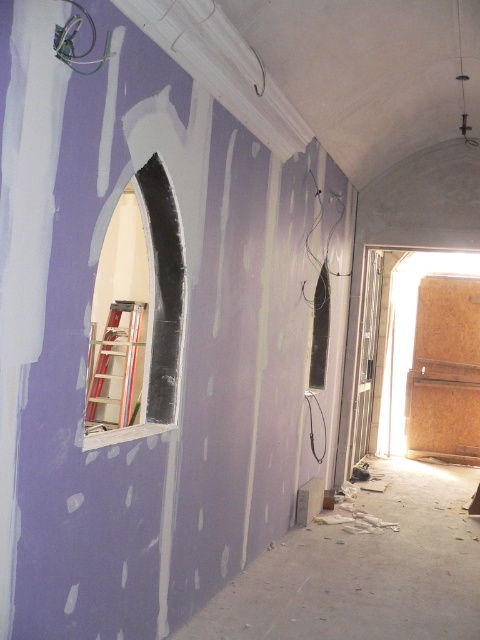
Can you confirm if smooth white archway at center is positioned below metallic silver ladder at left?

Incorrect, smooth white archway at center is not positioned below metallic silver ladder at left.

Which is more to the left, smooth white archway at center or metallic silver ladder at left?

Positioned to the left is metallic silver ladder at left.

This screenshot has width=480, height=640. In order to click on smooth white archway at center in this screenshot , I will do `click(164, 291)`.